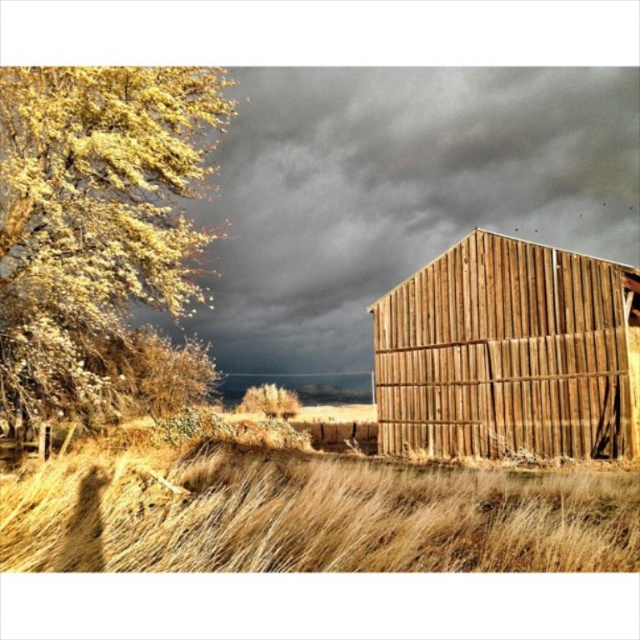
Between golden textured leaves at left and golden textured tree at center, which one has less height?

With less height is golden textured tree at center.

Can you confirm if golden textured leaves at left is positioned to the right of golden textured tree at center?

No, golden textured leaves at left is not to the right of golden textured tree at center.

Describe the element at coordinates (99, 241) in the screenshot. I see `golden textured leaves at left` at that location.

The width and height of the screenshot is (640, 640). I want to click on golden textured leaves at left, so click(x=99, y=241).

Is golden textured leaves at left smaller than dry straw at center?

Incorrect, golden textured leaves at left is not smaller in size than dry straw at center.

Is golden textured leaves at left thinner than dry straw at center?

Correct, golden textured leaves at left's width is less than dry straw at center's.

Who is more forward, (96, 397) or (476, 540)?

Point (476, 540) is in front.

In order to click on golden textured leaves at left in this screenshot , I will do `click(99, 241)`.

Which of these two, dry straw at center or wooden barn at right, stands taller?

With more height is wooden barn at right.

Who is more distant from viewer, (x=605, y=528) or (x=516, y=321)?

Positioned behind is point (x=516, y=321).

You are a GUI agent. You are given a task and a screenshot of the screen. Output one action in this format:
    pyautogui.click(x=<x>, y=<y>)
    Task: Click on the dry straw at center
    
    Given the screenshot: What is the action you would take?
    pyautogui.click(x=308, y=515)